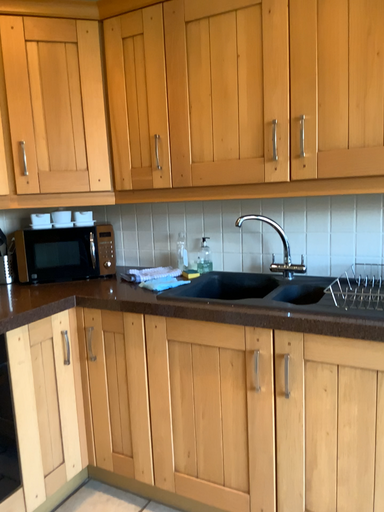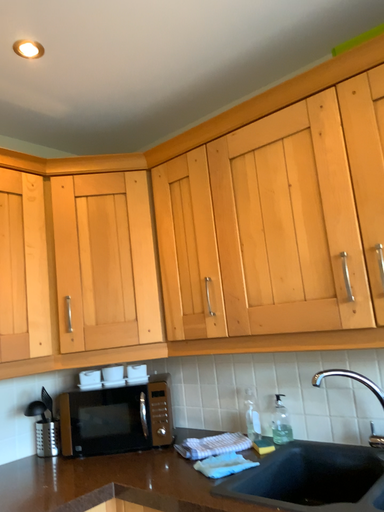
Question: Which way did the camera rotate in the video?

Choices:
 (A) rotated left
 (B) rotated right

Answer: (A)